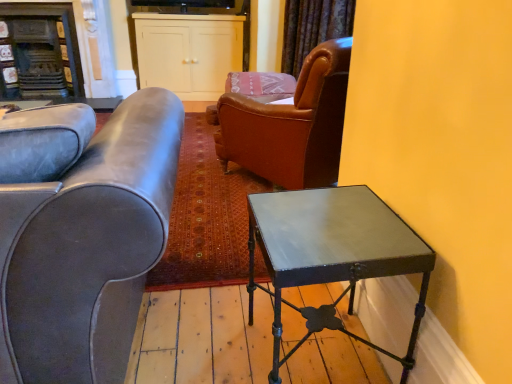
Question: Is metallic dark green table at right turned away from white matte cabinet at upper center?

Choices:
 (A) yes
 (B) no

Answer: (B)

Question: From the image's perspective, is metallic dark green table at right located above white matte cabinet at upper center?

Choices:
 (A) yes
 (B) no

Answer: (B)

Question: Would you say white matte cabinet at upper center is part of metallic dark green table at right's contents?

Choices:
 (A) no
 (B) yes

Answer: (A)

Question: Does metallic dark green table at right have a smaller size compared to white matte cabinet at upper center?

Choices:
 (A) no
 (B) yes

Answer: (B)

Question: Considering the relative sizes of metallic dark green table at right and white matte cabinet at upper center in the image provided, is metallic dark green table at right bigger than white matte cabinet at upper center?

Choices:
 (A) yes
 (B) no

Answer: (B)

Question: From the image's perspective, is metallic dark green table at right located beneath white matte cabinet at upper center?

Choices:
 (A) no
 (B) yes

Answer: (B)

Question: Does white matte cabinet at upper center have a greater width compared to dark brown wood fireplace at upper left?

Choices:
 (A) yes
 (B) no

Answer: (A)

Question: Is white matte cabinet at upper center facing away from dark brown wood fireplace at upper left?

Choices:
 (A) no
 (B) yes

Answer: (A)

Question: Does white matte cabinet at upper center lie in front of dark brown wood fireplace at upper left?

Choices:
 (A) yes
 (B) no

Answer: (B)

Question: Does white matte cabinet at upper center contain dark brown wood fireplace at upper left?

Choices:
 (A) no
 (B) yes

Answer: (A)

Question: Is white matte cabinet at upper center at the right side of dark brown wood fireplace at upper left?

Choices:
 (A) yes
 (B) no

Answer: (A)

Question: Is white matte cabinet at upper center aimed at dark brown wood fireplace at upper left?

Choices:
 (A) no
 (B) yes

Answer: (A)

Question: Is leather couch at left further to camera compared to velvet dark brown curtain at upper center?

Choices:
 (A) yes
 (B) no

Answer: (B)